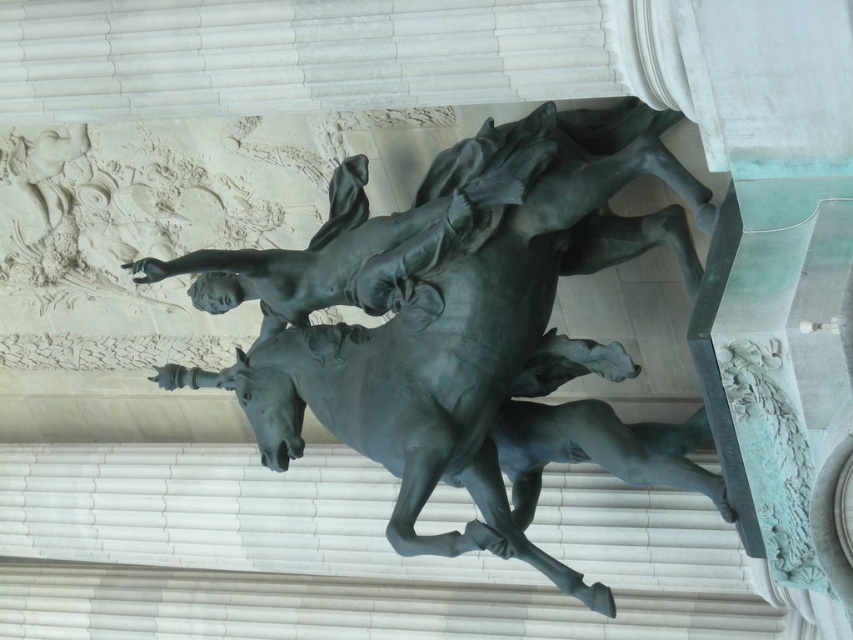
Question: Is bronze statue at center thinner than bronze statue at upper center?

Choices:
 (A) yes
 (B) no

Answer: (B)

Question: Is bronze statue at center smaller than bronze statue at upper center?

Choices:
 (A) yes
 (B) no

Answer: (B)

Question: Which of the following is the closest to the observer?

Choices:
 (A) (390, 448)
 (B) (450, 150)

Answer: (A)

Question: Can you confirm if bronze statue at center is wider than bronze statue at upper center?

Choices:
 (A) no
 (B) yes

Answer: (B)

Question: Among these objects, which one is farthest from the camera?

Choices:
 (A) bronze statue at upper center
 (B) bronze statue at center

Answer: (B)